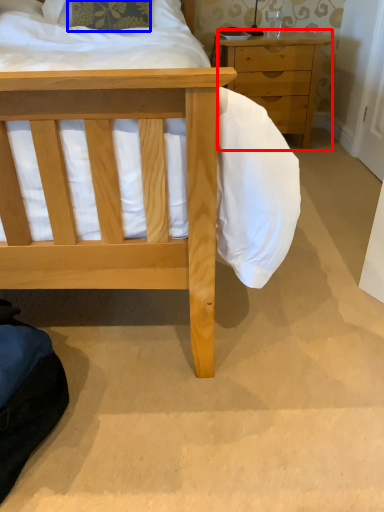
Question: Which object is further to the camera taking this photo, chest of drawers (highlighted by a red box) or pillow (highlighted by a blue box)?

Choices:
 (A) chest of drawers
 (B) pillow

Answer: (A)